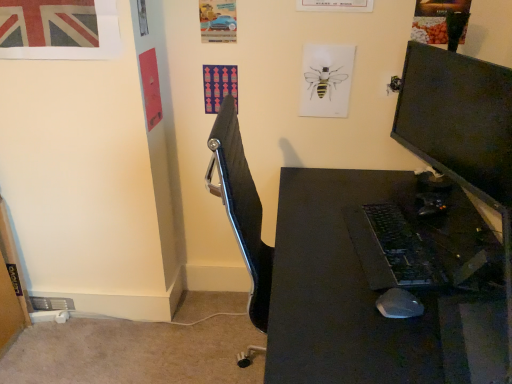
Question: Does union jack paper at upper left, marked as the second poster page in a right-to-left arrangement, have a greater height compared to black plastic keyboard at center-right?

Choices:
 (A) yes
 (B) no

Answer: (A)

Question: From the image's perspective, would you say union jack paper at upper left, marked as the second poster page in a right-to-left arrangement, is shown under black plastic keyboard at center-right?

Choices:
 (A) yes
 (B) no

Answer: (B)

Question: Is union jack paper at upper left, marked as the second poster page in a right-to-left arrangement, not near black plastic keyboard at center-right?

Choices:
 (A) yes
 (B) no

Answer: (A)

Question: Does union jack paper at upper left, marked as the second poster page in a right-to-left arrangement, have a larger size compared to black plastic keyboard at center-right?

Choices:
 (A) no
 (B) yes

Answer: (A)

Question: From a real-world perspective, does union jack paper at upper left, which is the 1th poster page in front-to-back order, sit lower than black plastic keyboard at center-right?

Choices:
 (A) no
 (B) yes

Answer: (A)

Question: Based on their positions, is union jack paper at upper left, marked as the 1th poster page in a left-to-right arrangement, located to the left or right of black plastic mouse at lower right?

Choices:
 (A) right
 (B) left

Answer: (B)

Question: From the image's perspective, is union jack paper at upper left, marked as the 1th poster page in a left-to-right arrangement, above or below black plastic mouse at lower right?

Choices:
 (A) above
 (B) below

Answer: (A)

Question: Is union jack paper at upper left, arranged as the second poster page when viewed from the back, inside the boundaries of black plastic mouse at lower right, or outside?

Choices:
 (A) inside
 (B) outside

Answer: (B)

Question: From a real-world perspective, relative to black plastic mouse at lower right, is union jack paper at upper left, marked as the 1th poster page in a left-to-right arrangement, vertically above or below?

Choices:
 (A) below
 (B) above

Answer: (B)

Question: Is metallic blue car at upper center, the first poster page from the back, taller or shorter than black plastic mouse at lower right?

Choices:
 (A) tall
 (B) short

Answer: (A)

Question: From a real-world perspective, relative to black plastic mouse at lower right, is metallic blue car at upper center, the first poster page from the back, vertically above or below?

Choices:
 (A) above
 (B) below

Answer: (A)

Question: Does point (212, 34) appear closer or farther from the camera than point (408, 304)?

Choices:
 (A) farther
 (B) closer

Answer: (A)

Question: In the image, is metallic blue car at upper center, placed as the 2th poster page when sorted from left to right, on the left side or the right side of black plastic mouse at lower right?

Choices:
 (A) right
 (B) left

Answer: (B)

Question: Does point (397, 281) appear closer or farther from the camera than point (65, 36)?

Choices:
 (A) closer
 (B) farther

Answer: (A)

Question: Choose the correct answer: Is black plastic keyboard at center-right inside union jack paper at upper left, marked as the 1th poster page in a left-to-right arrangement, or outside it?

Choices:
 (A) outside
 (B) inside

Answer: (A)